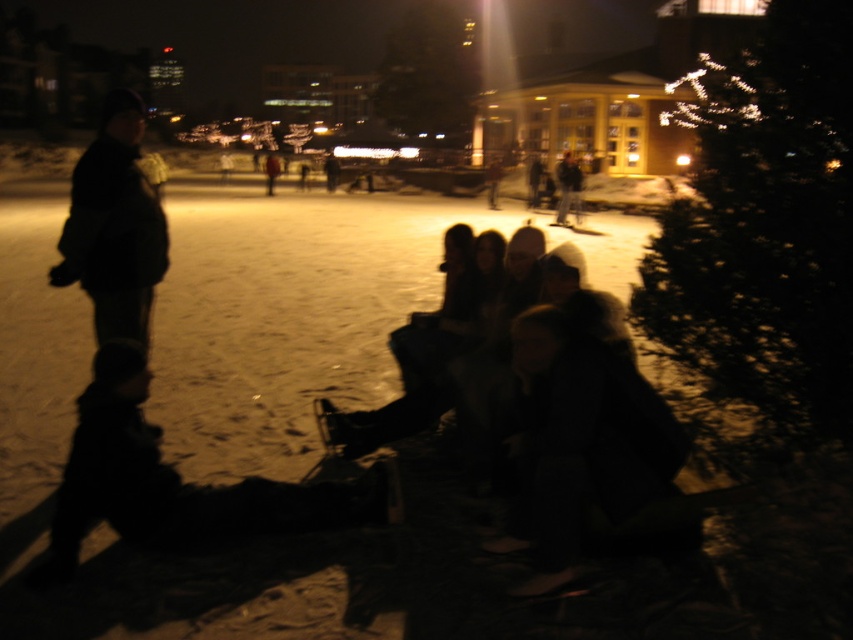
Between dark fabric jacket at lower left and black fabric jacket at left, which one appears on the left side from the viewer's perspective?

black fabric jacket at left is more to the left.

Locate an element on the screen. The image size is (853, 640). dark fabric jacket at lower left is located at coordinates (175, 483).

Where is `dark fabric jacket at lower left`? dark fabric jacket at lower left is located at coordinates [x=175, y=483].

Who is positioned more to the right, dark fabric jacket at lower left or dark gray jacket at center?

Positioned to the right is dark gray jacket at center.

Is dark fabric jacket at lower left positioned before dark gray jacket at center?

That is True.

Describe the element at coordinates (175, 483) in the screenshot. I see `dark fabric jacket at lower left` at that location.

Where is `dark fabric jacket at lower left`? Image resolution: width=853 pixels, height=640 pixels. dark fabric jacket at lower left is located at coordinates (175, 483).

Between black fabric jacket at left and dark gray jacket at center, which one has more height?

dark gray jacket at center

Does black fabric jacket at left have a greater height compared to dark gray jacket at center?

In fact, black fabric jacket at left may be shorter than dark gray jacket at center.

Where is `black fabric jacket at left`? The height and width of the screenshot is (640, 853). black fabric jacket at left is located at coordinates (114, 227).